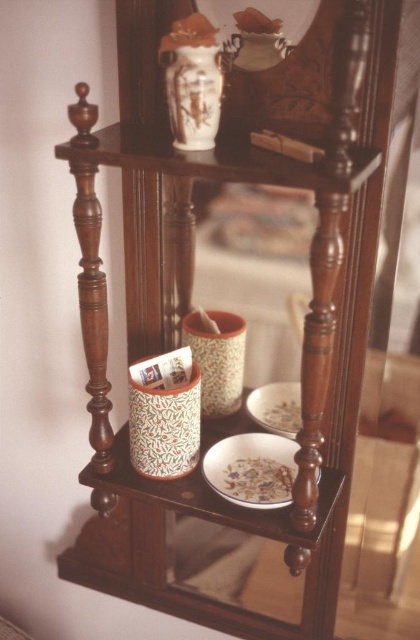
Question: Does white glossy plate at lower center have a larger size compared to white matte bowl at lower center?

Choices:
 (A) no
 (B) yes

Answer: (B)

Question: Which point appears farthest from the camera in this image?

Choices:
 (A) (296, 400)
 (B) (270, 488)

Answer: (A)

Question: Is white glossy plate at center smaller than white glossy plate at lower center?

Choices:
 (A) yes
 (B) no

Answer: (B)

Question: Is the position of porcelain vase at upper center less distant than that of white glossy plate at lower center?

Choices:
 (A) no
 (B) yes

Answer: (B)

Question: Which object is positioned closest to the white matte bowl at lower center?

Choices:
 (A) white glossy plate at center
 (B) porcelain vase at upper center

Answer: (A)

Question: Which point is closer to the camera?

Choices:
 (A) white glossy plate at center
 (B) porcelain vase at upper center

Answer: (B)